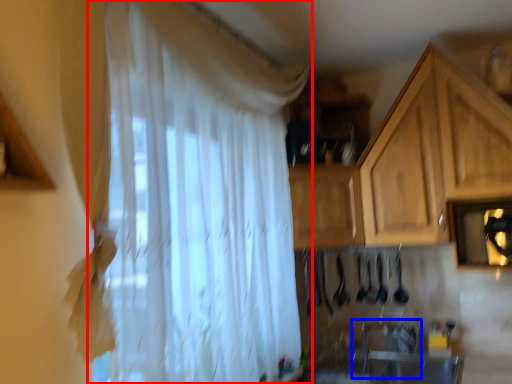
Question: Which of the following is the farthest to the observer, curtain (highlighted by a red box) or sink (highlighted by a blue box)?

Choices:
 (A) curtain
 (B) sink

Answer: (B)